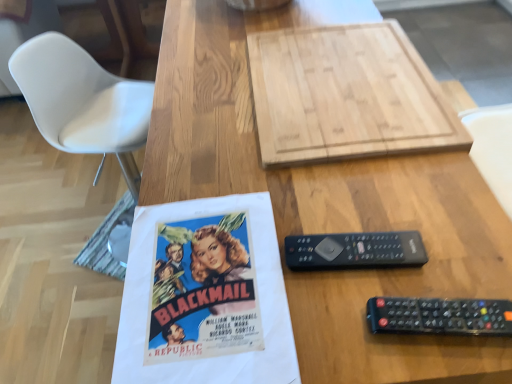
Identify the location of free space that is in between black plastic remote at right and natural wood cutting board at upper center. Image resolution: width=512 pixels, height=384 pixels. (367, 200).